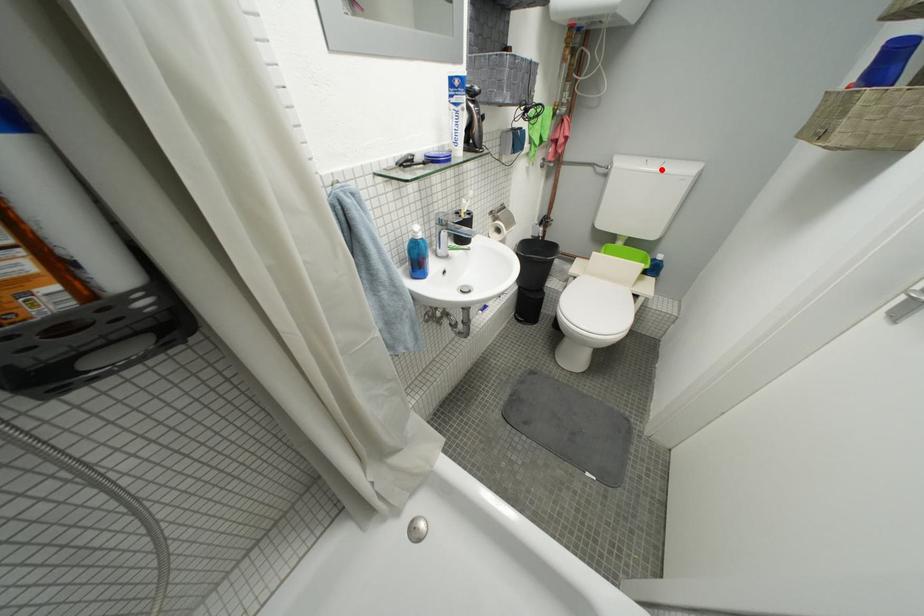
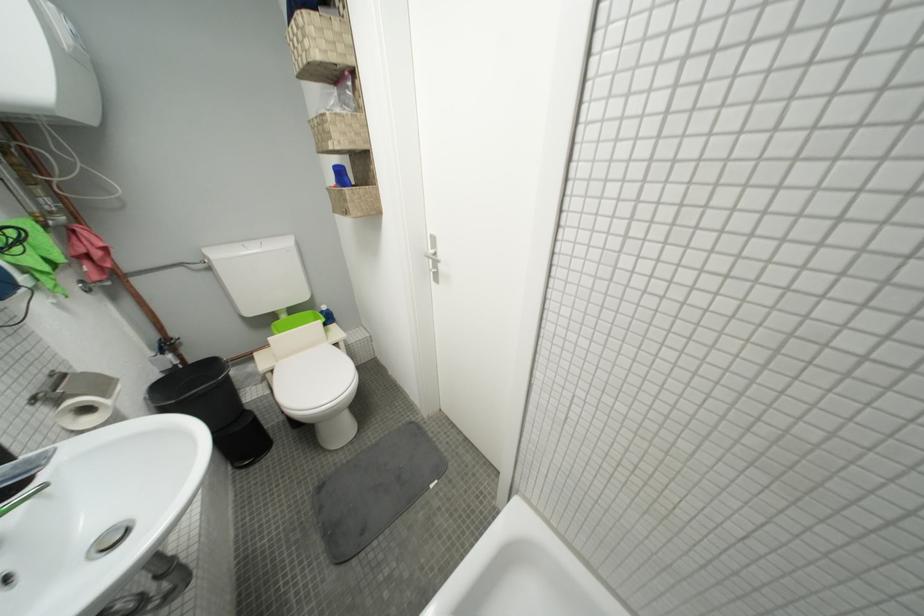
Question: I am providing you with two images of the same scene from different viewpoints. A red point is shown in image1. For the corresponding object point in image2, is it positioned nearer or farther from the camera?

Choices:
 (A) Nearer
 (B) Farther

Answer: (B)